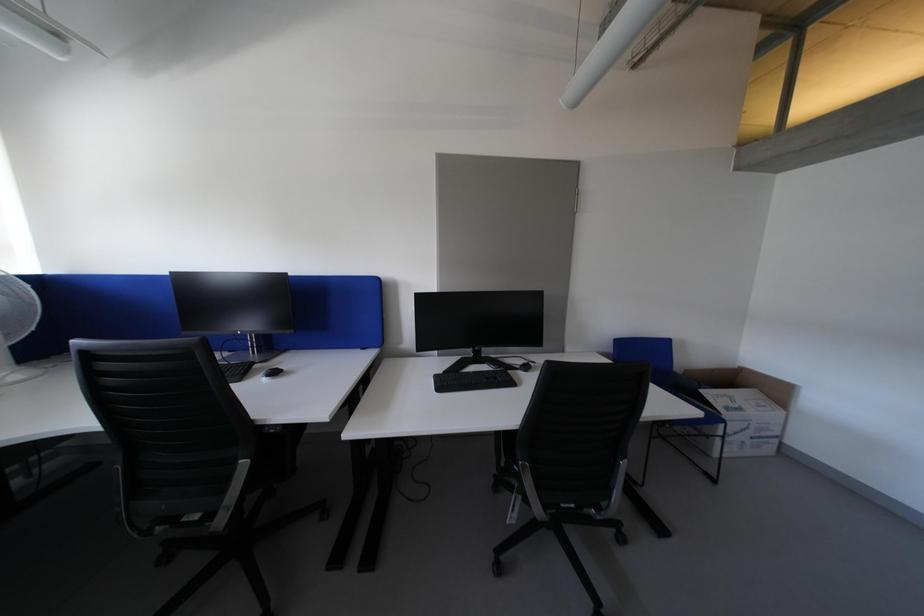
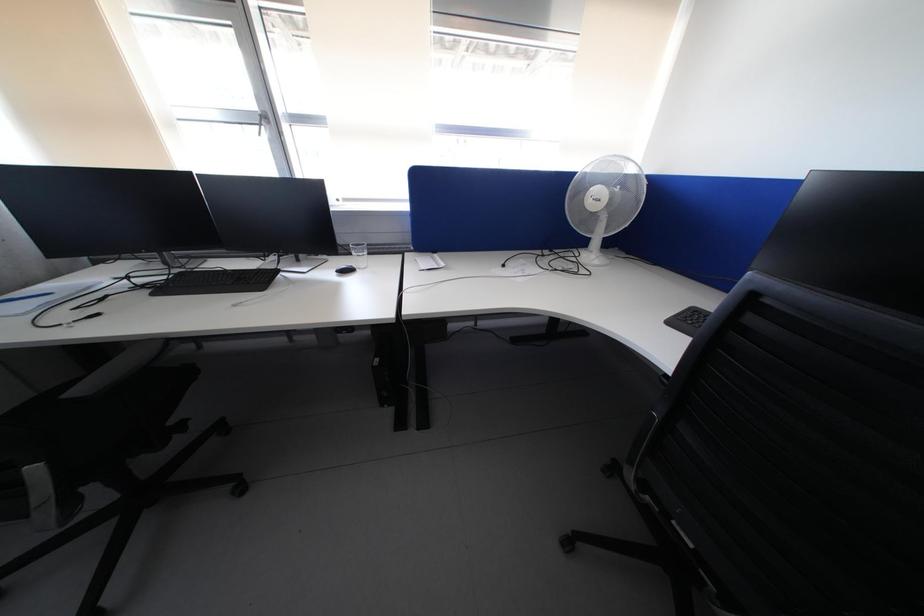
First-person continuous shooting, in which direction is the camera rotating?

The camera rotated toward left-down.